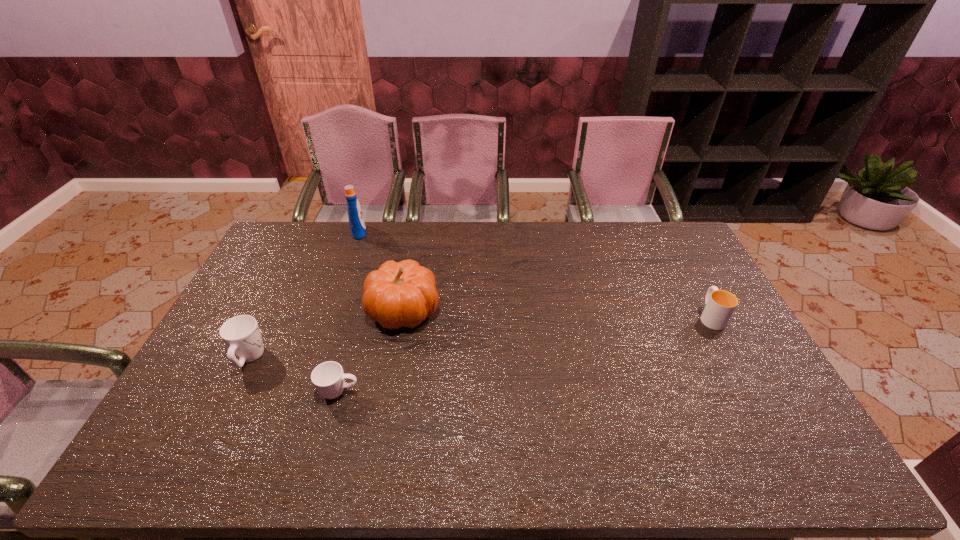
This screenshot has width=960, height=540. Find the location of `free space that is in between the leftmost object and the second tallest object`. free space that is in between the leftmost object and the second tallest object is located at coordinates pyautogui.click(x=326, y=334).

At what (x,y) coordinates should I click in order to perform the action: click on free space between the mug and the second tallest object. Please return your answer as a coordinate pair (x, y). The width and height of the screenshot is (960, 540). Looking at the image, I should click on (326, 334).

The image size is (960, 540). Find the location of `free area in between the nearer cup and the detergent`. free area in between the nearer cup and the detergent is located at coordinates (349, 312).

I want to click on free spot between the tallest object and the rightmost object, so click(x=535, y=274).

Where is `free space between the pumpkin and the rightmost object`? The image size is (960, 540). free space between the pumpkin and the rightmost object is located at coordinates (557, 313).

Find the location of a particular element. The image size is (960, 540). vacant space that is in between the farther cup and the shortest object is located at coordinates (525, 354).

Locate which object ranks in proximity to the right cup. Please provide its 2D coordinates. Your answer should be formatted as a tuple, i.e. [(x, y)], where the tuple contains the x and y coordinates of a point satisfying the conditions above.

[(403, 294)]

At what (x,y) coordinates should I click in order to perform the action: click on object that stands as the second closest to the fourth tallest object. Please return your answer as a coordinate pair (x, y). Looking at the image, I should click on (328, 378).

Where is `vacant space that satisfies the following two spatial constraints: 1. on the front side of the second tallest object; 2. with the handle on the side of the shortest object`? vacant space that satisfies the following two spatial constraints: 1. on the front side of the second tallest object; 2. with the handle on the side of the shortest object is located at coordinates (388, 392).

Image resolution: width=960 pixels, height=540 pixels. Identify the location of vacant space that satisfies the following two spatial constraints: 1. on the front side of the pumpkin; 2. with the handle on the side of the nearer cup. (388, 392).